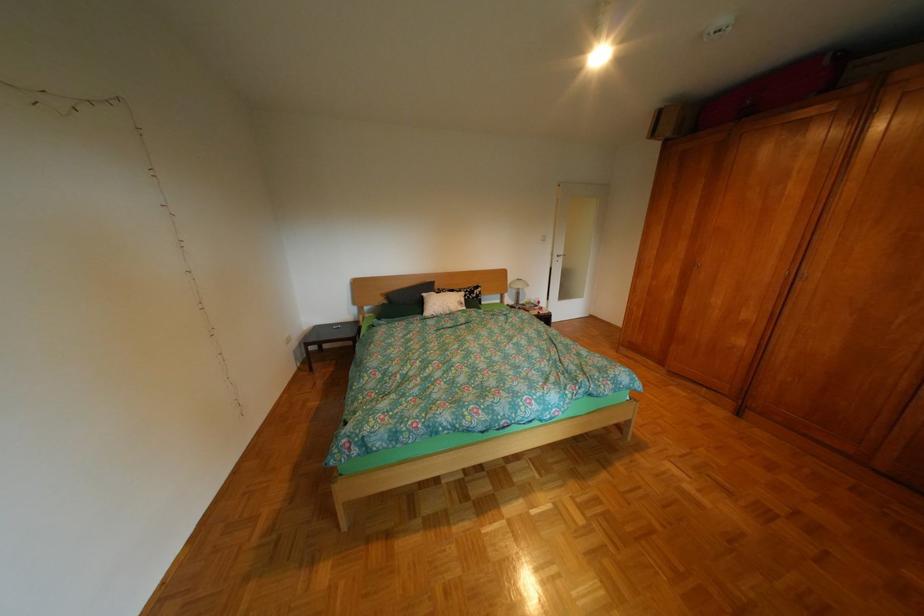
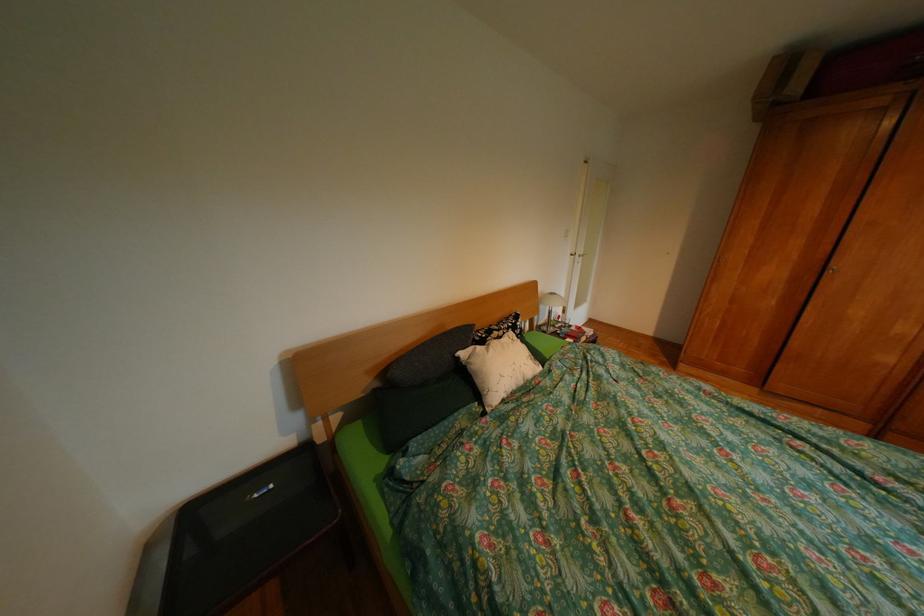
The point at (400, 302) is marked in the first image. Where is the corresponding point in the second image?

(392, 385)